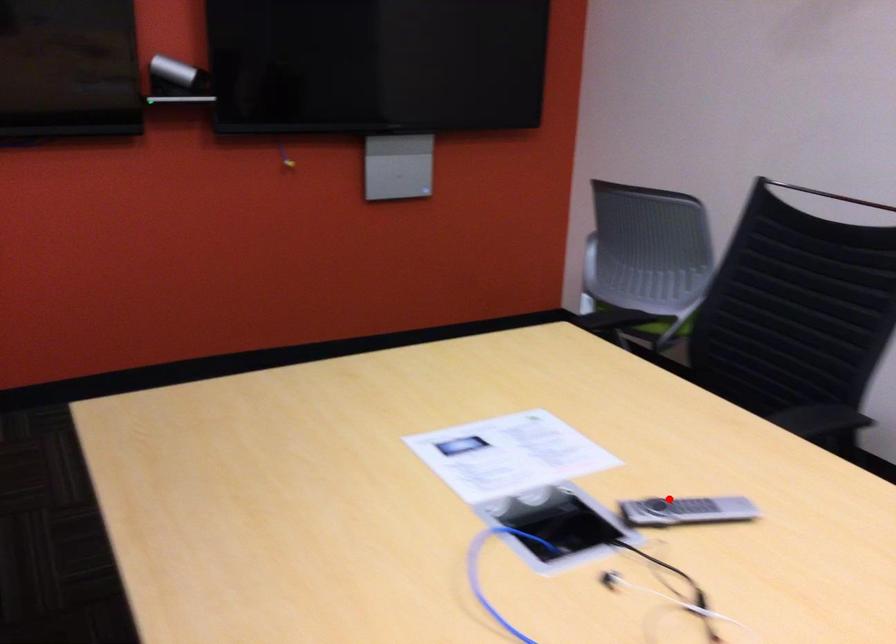
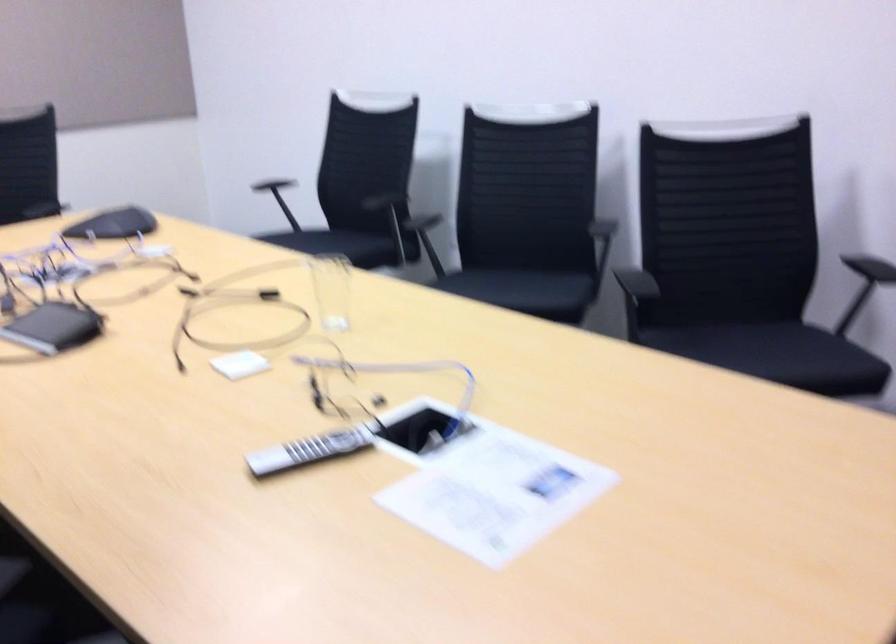
Locate, in the second image, the point that corresponds to the highlighted location in the first image.

(308, 450)